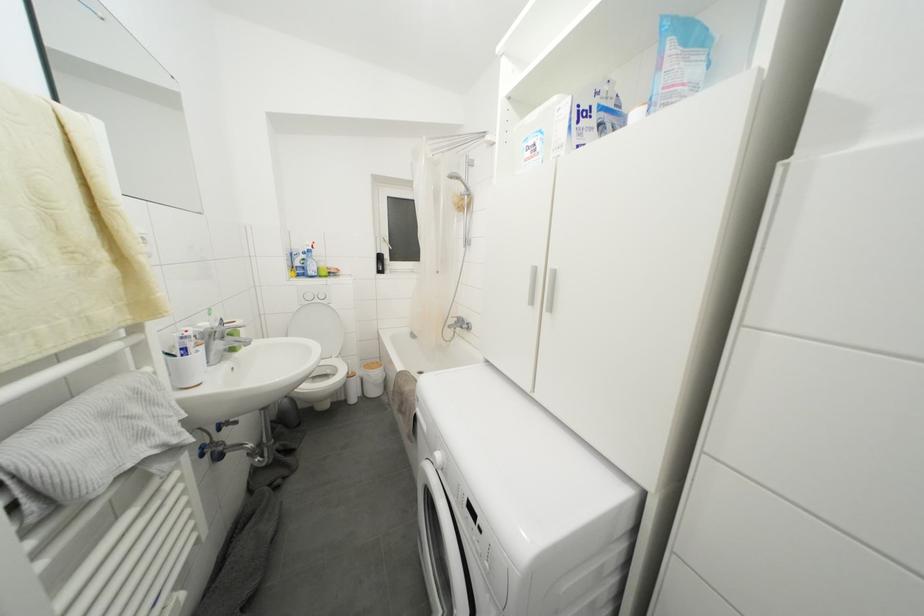
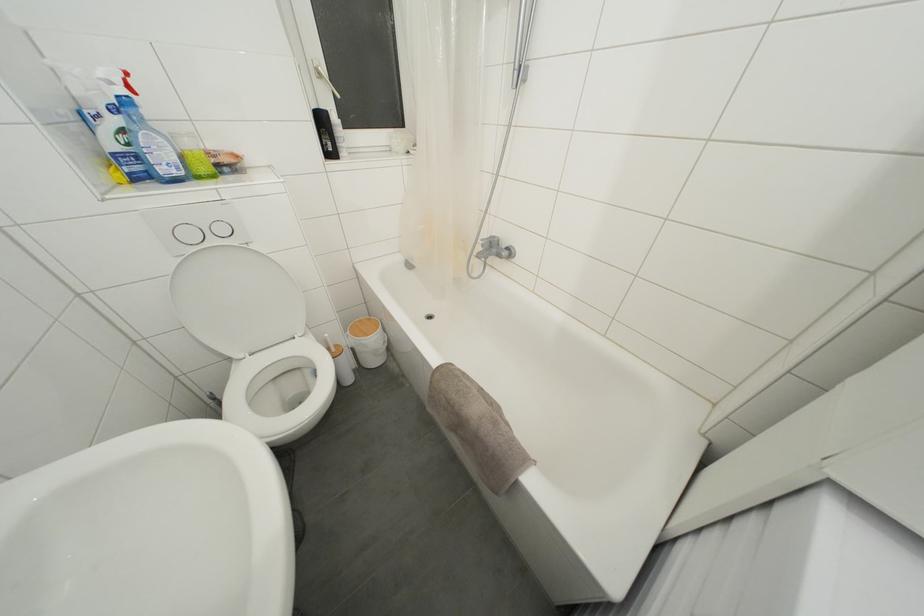
Locate, in the second image, the point that corresponds to point (325, 301) in the first image.

(226, 235)